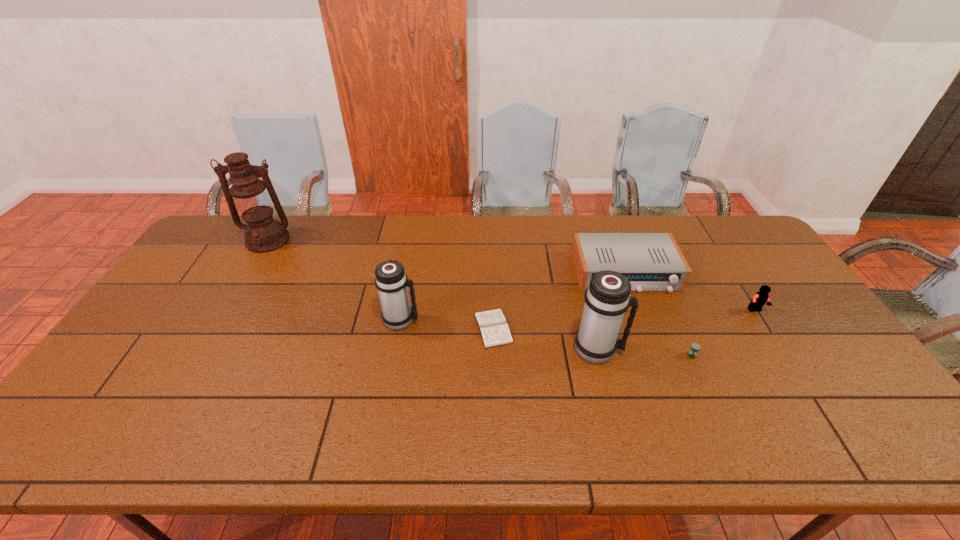
In the current image, all thermos bottles are evenly spaced. To maintain this equal spacing, where should an additional thermos bottle be placed on the right? Please point out a free spot. Please provide its 2D coordinates. Your answer should be formatted as a tuple, i.e. [(x, y)], where the tuple contains the x and y coordinates of a point satisfying the conditions above.

[(822, 383)]